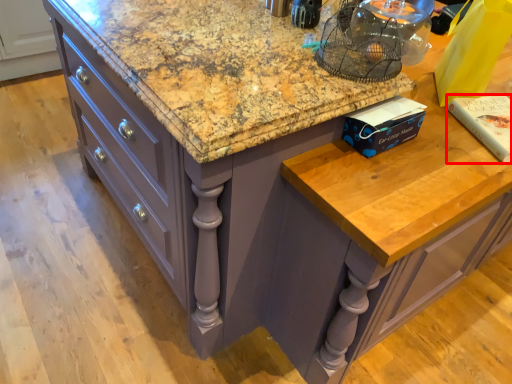
Question: From the image's perspective, what is the correct spatial positioning of book (annotated by the red box) in reference to book?

Choices:
 (A) above
 (B) below

Answer: (A)